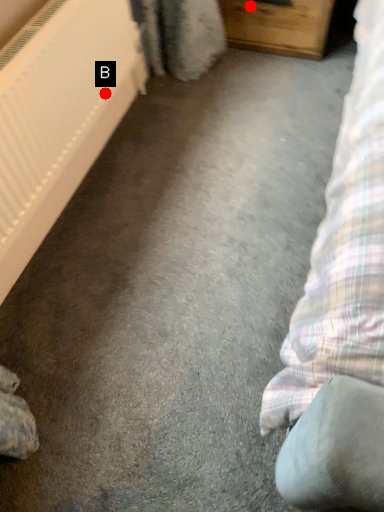
Question: Two points are circled on the image, labeled by A and B beside each circle. Which of the following is the closest to the observer?

Choices:
 (A) A is closer
 (B) B is closer

Answer: (B)